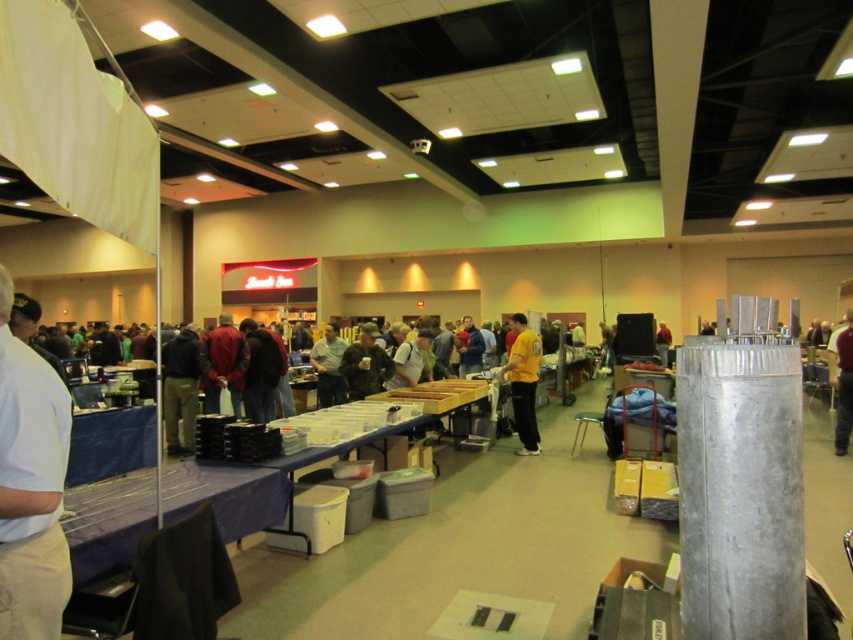
You are standing at the entrance of the convention center and see two points in the image. Which point, point (x=36, y=600) or point (x=517, y=317), is nearer to you?

Point (x=36, y=600) is closer to the camera than point (x=517, y=317), so it is nearer to you.

You are standing at the point marked as point (521, 353) and want to walk to the exit located at point (840, 433). Is there a clear path between these two points?

Yes, since point (521, 353) is in front of point (840, 433), there is a clear path between them.